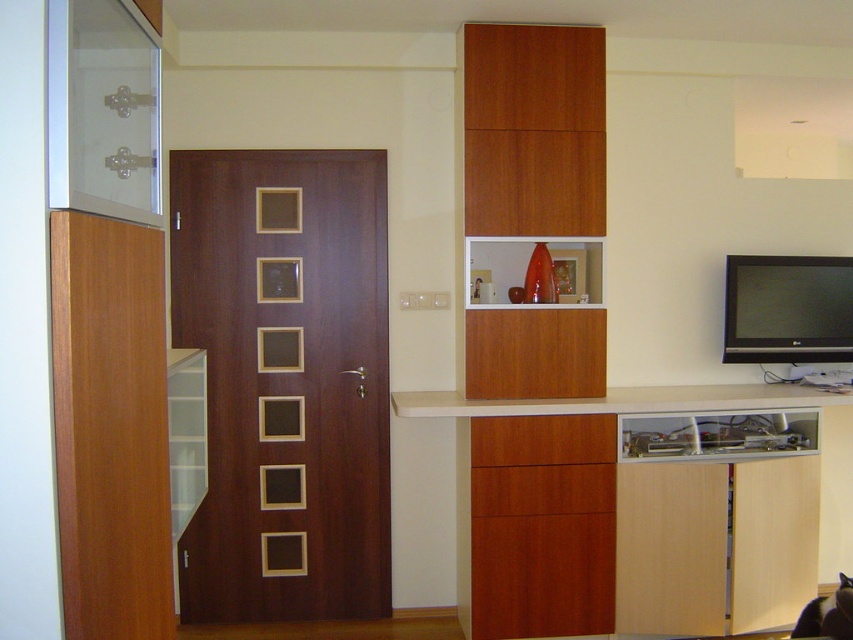
From the picture: Can you confirm if wooden cabinet at lower center is positioned to the right of wooden drawer at lower center?

Answer: Indeed, wooden cabinet at lower center is positioned on the right side of wooden drawer at lower center.

Is point (508, 426) farther from camera compared to point (573, 508)?

No.

I want to click on wooden cabinet at lower center, so click(x=543, y=440).

Is black glossy tv at right thinner than wooden cabinet at lower center?

Incorrect, black glossy tv at right's width is not less than wooden cabinet at lower center's.

Who is positioned more to the right, black glossy tv at right or wooden cabinet at lower center?

Positioned to the right is black glossy tv at right.

Does point (804, 340) lie behind point (538, 435)?

Yes, it is behind point (538, 435).

Identify the location of black glossy tv at right. (787, 308).

Between black glossy tv at right and wooden drawer at lower center, which one is positioned higher?

black glossy tv at right is higher up.

Does black glossy tv at right have a greater width compared to wooden drawer at lower center?

Yes.

Where is `black glossy tv at right`? black glossy tv at right is located at coordinates (787, 308).